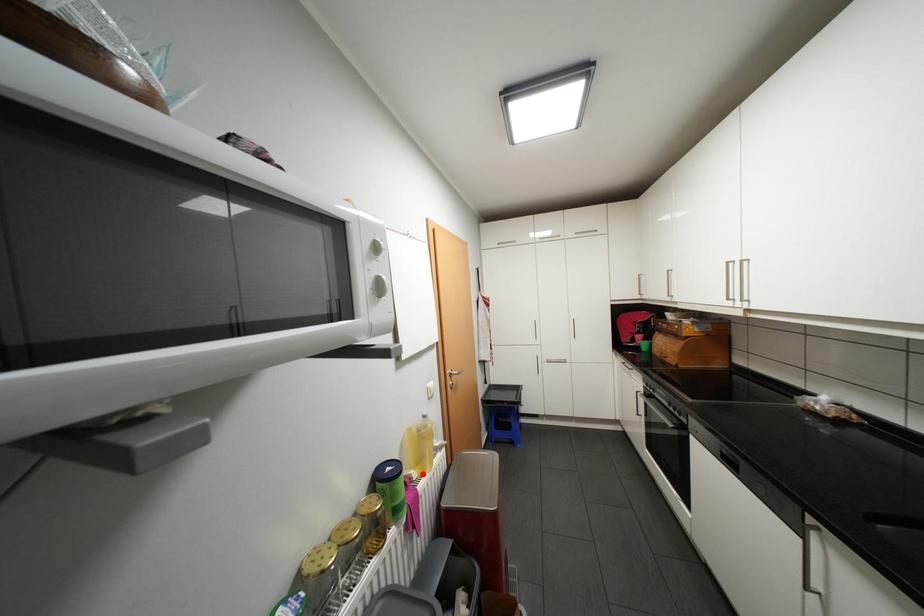
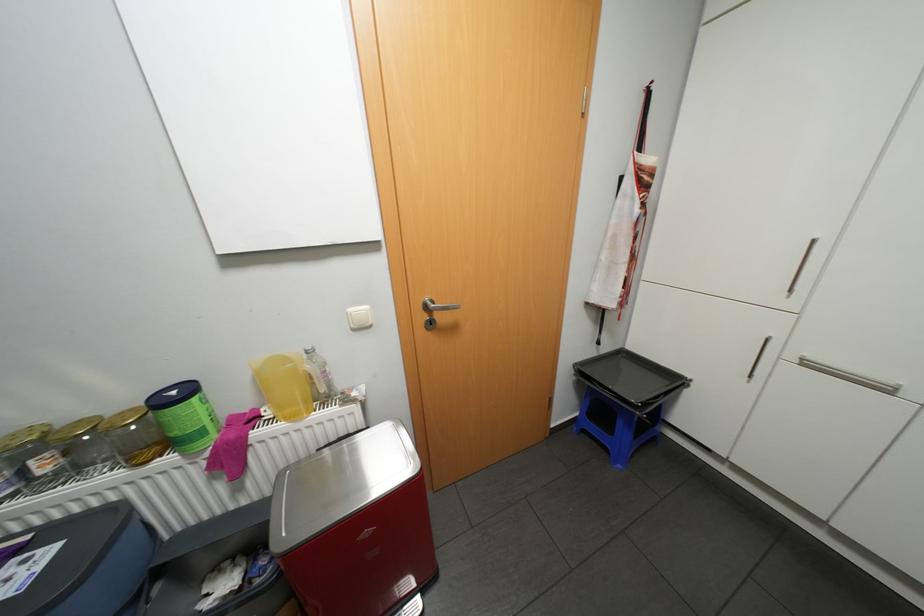
Question: I am providing you with two images of the same scene from different viewpoints. A red point is marked on the first image. Can you still see the location of the red point in image 2?

Choices:
 (A) Yes
 (B) No

Answer: (A)